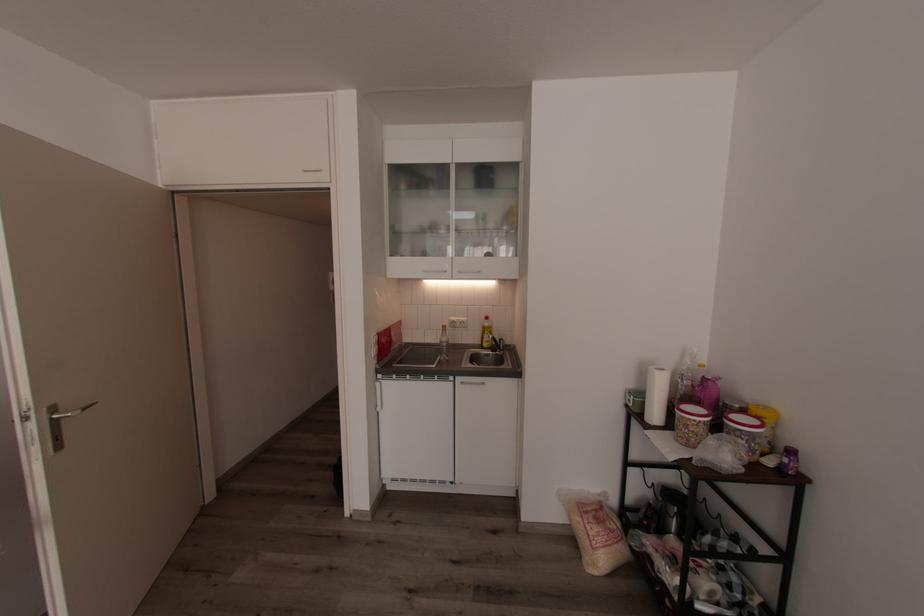
Find where to pull the silver door handle. Please return your answer as a coordinate pair (x, y).

(79, 410)